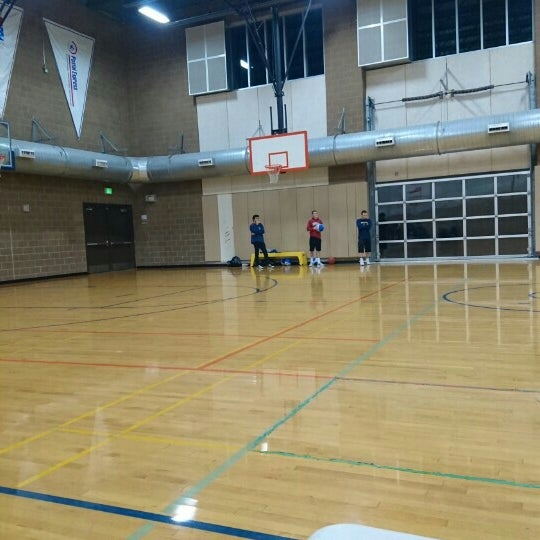
The width and height of the screenshot is (540, 540). I want to click on brick wall, so coord(183,213), coord(33,224).